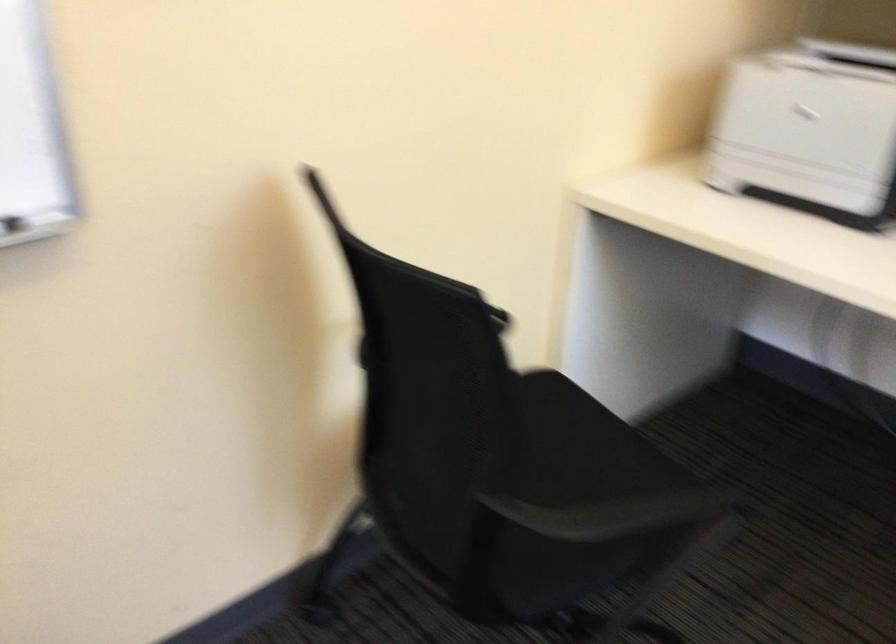
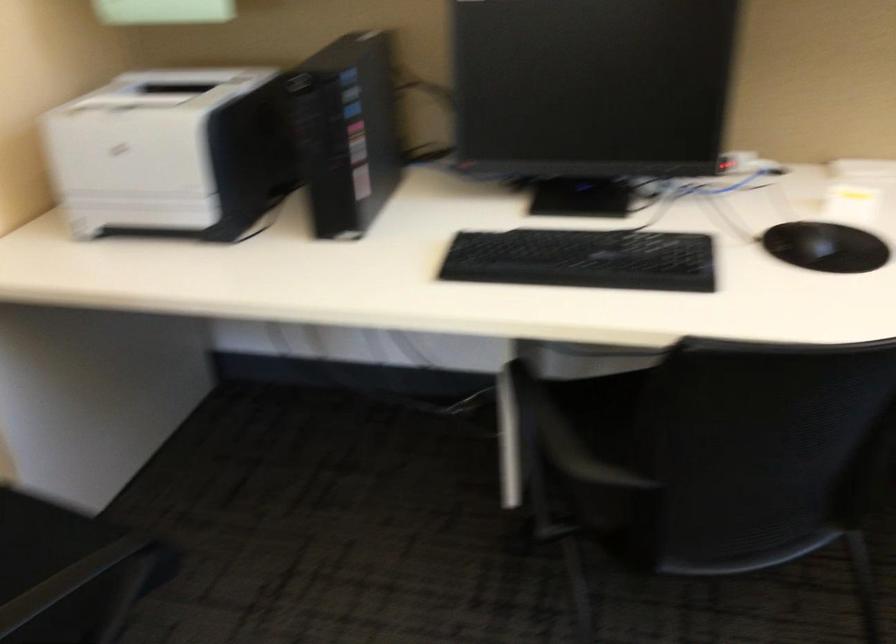
Question: Based on the continuous images, in which direction is the camera rotating? Reply with the corresponding letter.

Choices:
 (A) Left
 (B) Right
 (C) Up
 (D) Down

Answer: (B)